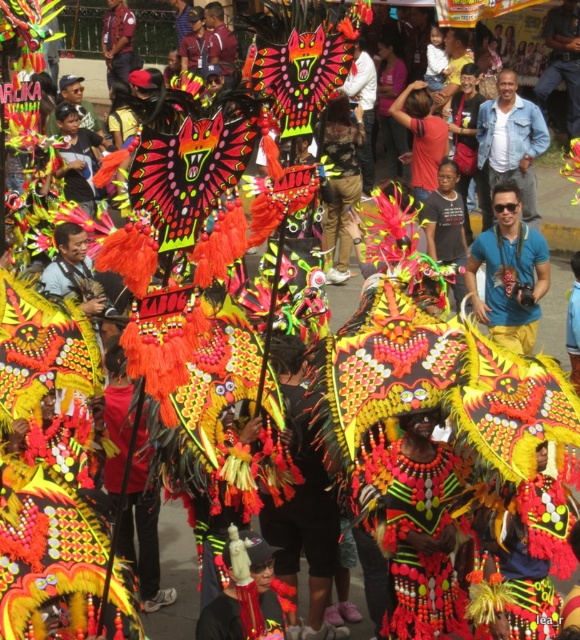
Which is behind, point (502, 198) or point (577, 262)?

The point (502, 198) is behind.

Is blue fabric shirt at center bigger than blue fabric at center?

No, blue fabric shirt at center is not bigger than blue fabric at center.

Between point (476, 260) and point (572, 273), which one is positioned in front?

Point (476, 260)

Identify the location of blue fabric shirt at center. This screenshot has width=580, height=640. point(509,273).